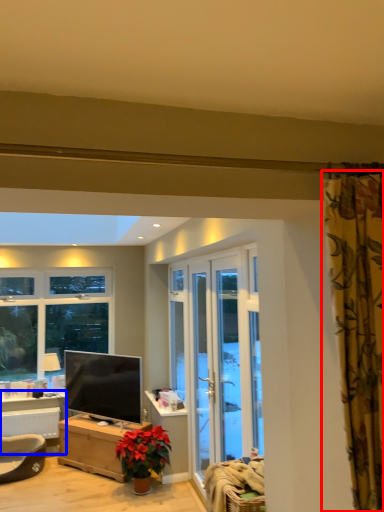
Question: Which object appears farthest to the camera in this image, curtain (highlighted by a red box) or table (highlighted by a blue box)?

Choices:
 (A) curtain
 (B) table

Answer: (B)